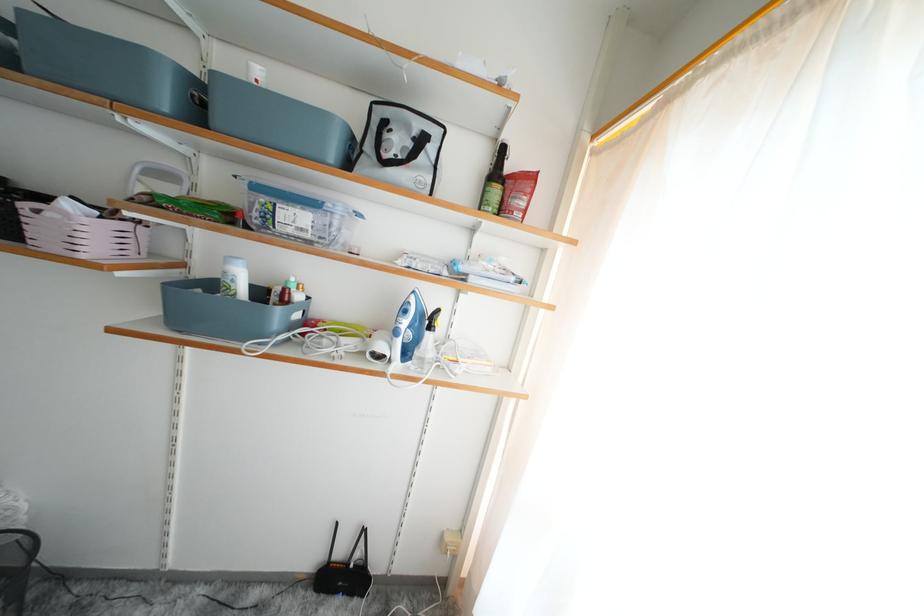
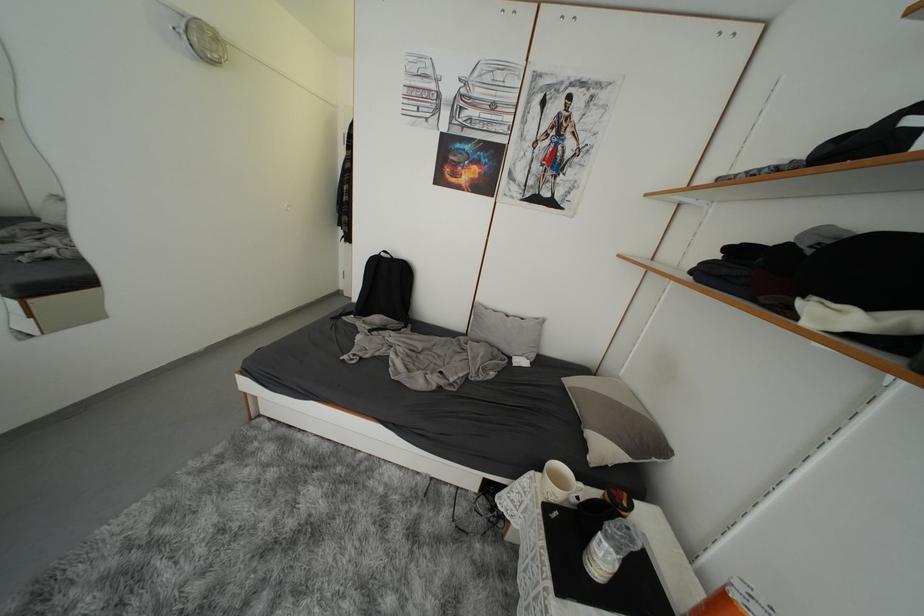
Question: The camera is either moving clockwise (left) or counter-clockwise (right) around the object. The first image is from the beginning of the video and the second image is from the end. Is the camera moving left or right when shooting the video?

Choices:
 (A) Left
 (B) Right

Answer: (B)